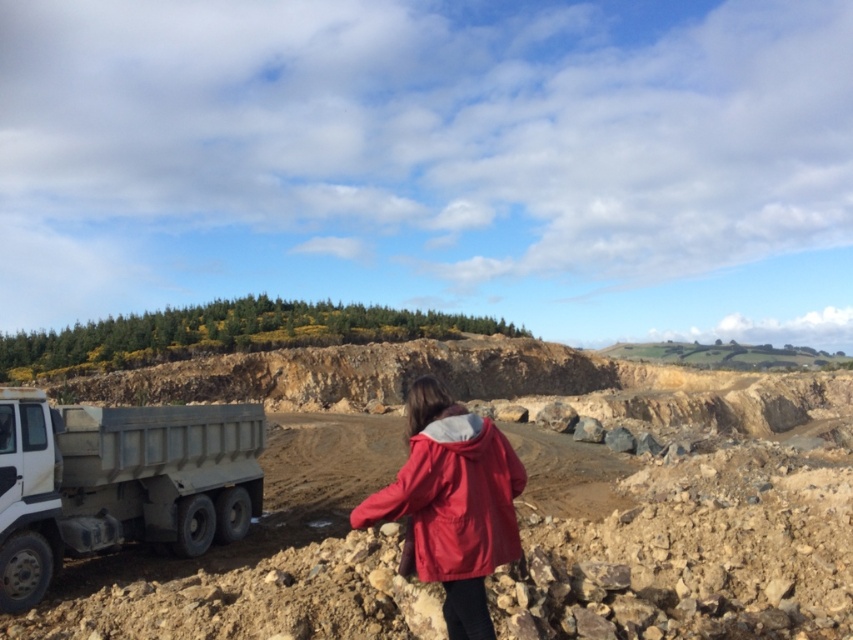
Question: Which object appears closest to the camera in this image?

Choices:
 (A) matte gray truck at lower left
 (B) matte red jacket at center
 (C) white metallic truck at lower left

Answer: (B)

Question: Which point is farther from the camera taking this photo?

Choices:
 (A) (440, 627)
 (B) (376, 499)

Answer: (A)

Question: Is white metallic truck at lower left to the right of matte gray truck at lower left from the viewer's perspective?

Choices:
 (A) yes
 (B) no

Answer: (A)

Question: Is white metallic truck at lower left positioned at the back of matte red jacket at center?

Choices:
 (A) no
 (B) yes

Answer: (B)

Question: Which object appears closest to the camera in this image?

Choices:
 (A) white metallic truck at lower left
 (B) matte gray truck at lower left
 (C) matte red jacket at center

Answer: (C)

Question: Is white metallic truck at lower left smaller than matte red jacket at center?

Choices:
 (A) yes
 (B) no

Answer: (B)